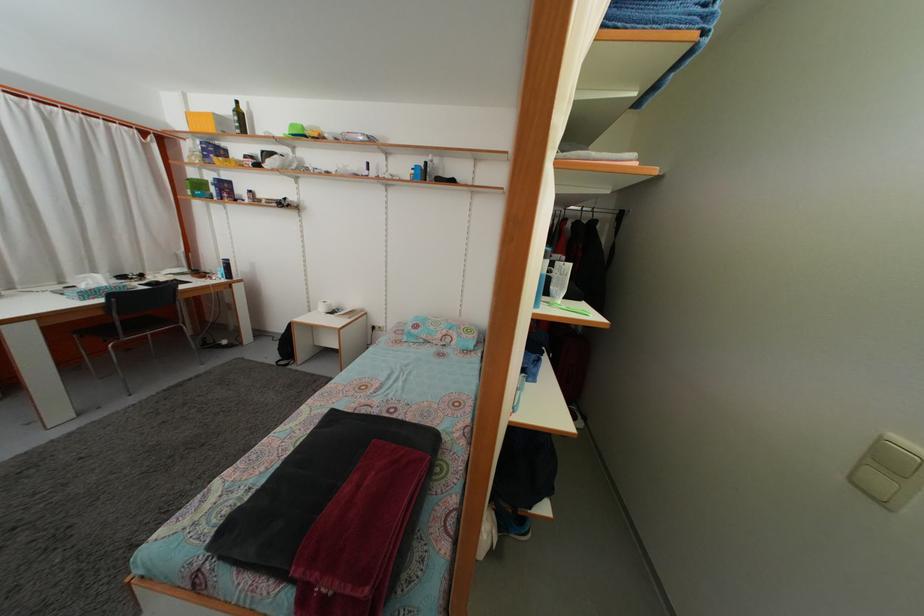
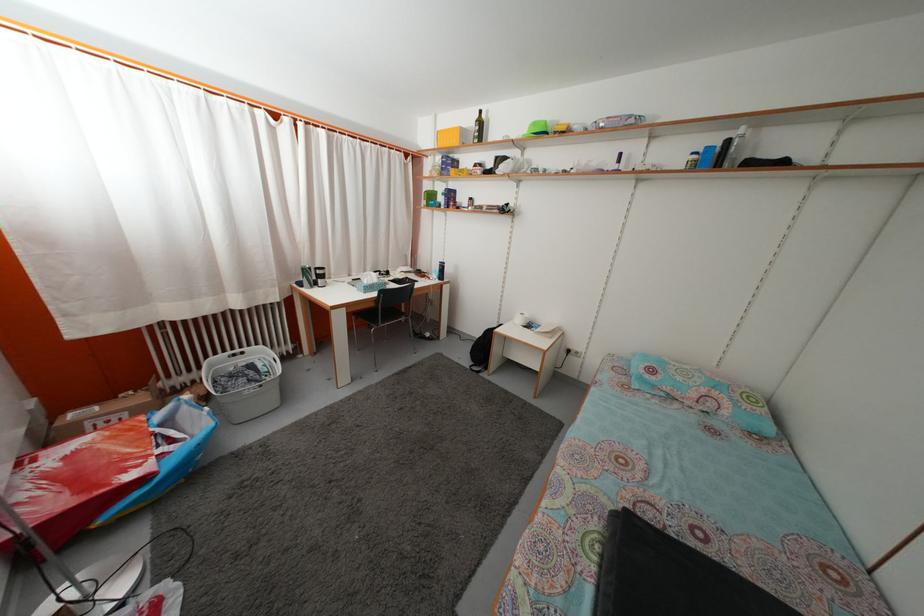
Find the pixel in the second image that matches pixel 287 336 in the first image.

(482, 342)